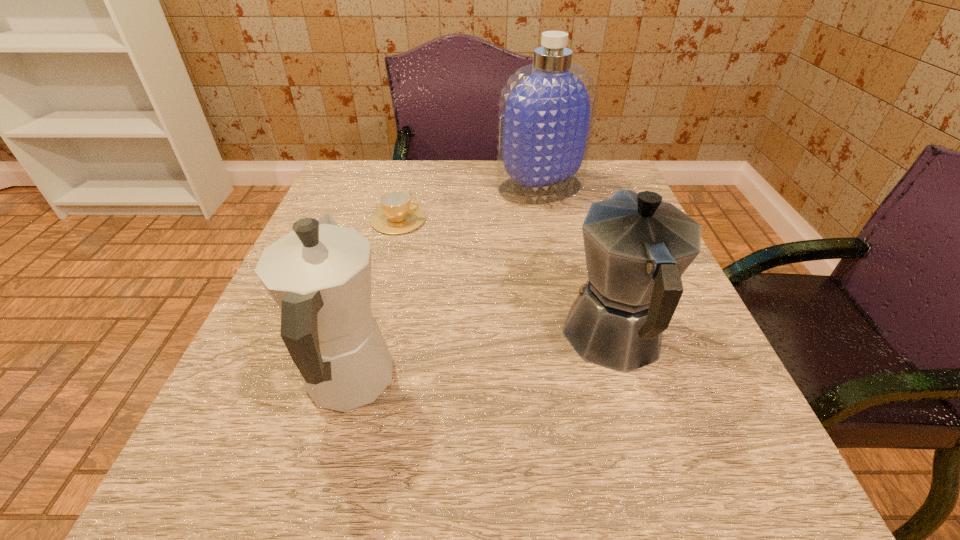
Find the location of a particular element. The width and height of the screenshot is (960, 540). the tallest object is located at coordinates (547, 109).

Locate an element on the screen. The height and width of the screenshot is (540, 960). the left coffeepot is located at coordinates (319, 275).

Locate an element on the screen. This screenshot has width=960, height=540. the right coffeepot is located at coordinates (637, 247).

Where is `the shortest object`? The height and width of the screenshot is (540, 960). the shortest object is located at coordinates (397, 215).

The width and height of the screenshot is (960, 540). What are the coordinates of `vacant space situated on the left of the cleansing agent` in the screenshot? It's located at [x=357, y=187].

At what (x,y) coordinates should I click in order to perform the action: click on vacant space located on the right of the left coffeepot. Please return your answer as a coordinate pair (x, y). The height and width of the screenshot is (540, 960). Looking at the image, I should click on (576, 383).

The width and height of the screenshot is (960, 540). What are the coordinates of `free space located 0.260m at the spout of the right coffeepot` in the screenshot? It's located at (576, 212).

Where is `free space located at the spout of the right coffeepot`? free space located at the spout of the right coffeepot is located at coordinates (570, 192).

In order to click on free space located at the spout of the right coffeepot in this screenshot , I will do `click(580, 224)`.

You are a GUI agent. You are given a task and a screenshot of the screen. Output one action in this format:
    pyautogui.click(x=<x>, y=<y>)
    Task: Click on the vacant space positioned 0.230m with the handle on the side of the cup
    Image resolution: width=960 pixels, height=540 pixels.
    Given the screenshot: What is the action you would take?
    pyautogui.click(x=530, y=220)